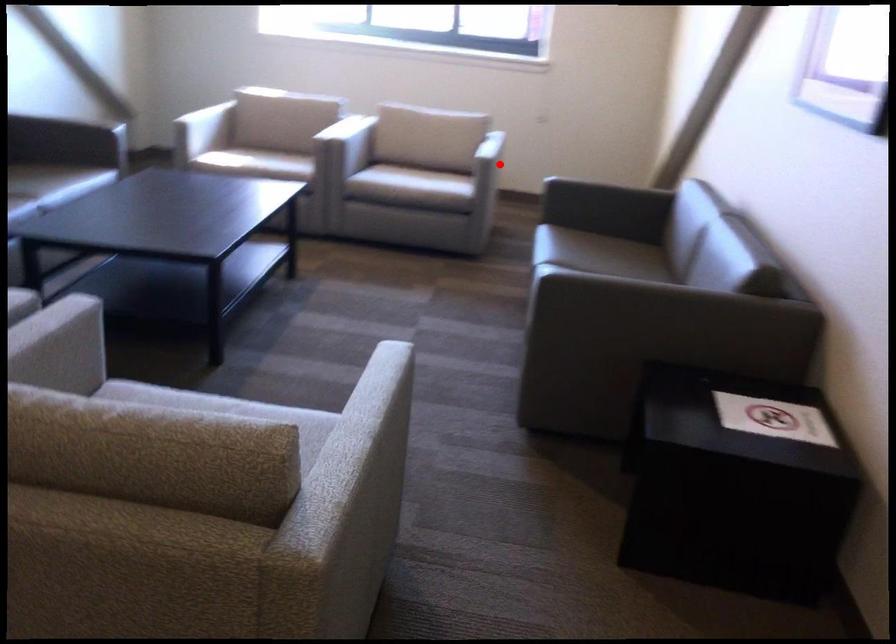
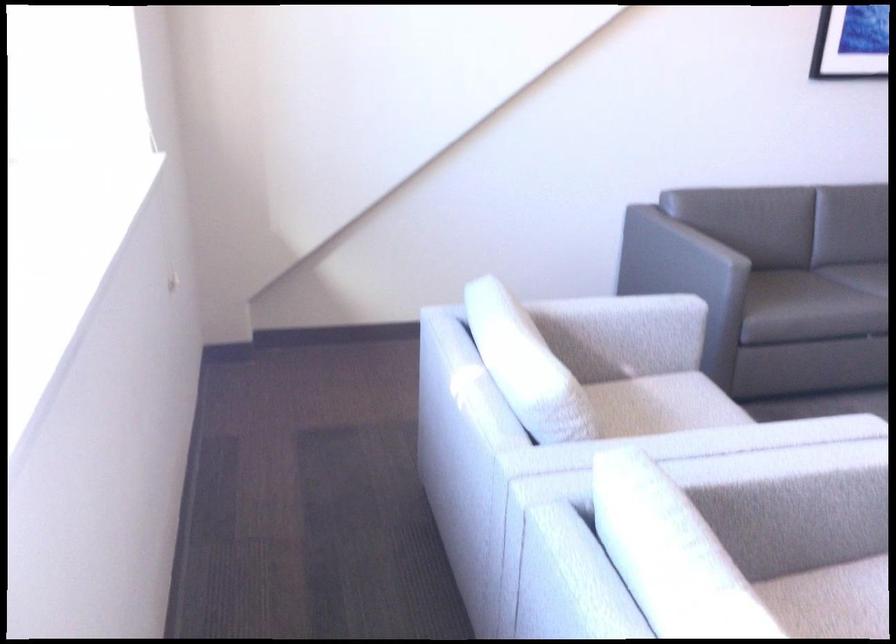
Question: I am providing you with two images of the same scene from different viewpoints. A red point is marked on the first image. At the location where the point appears in image 1, is it still visible in image 2?

Choices:
 (A) Yes
 (B) No

Answer: (B)